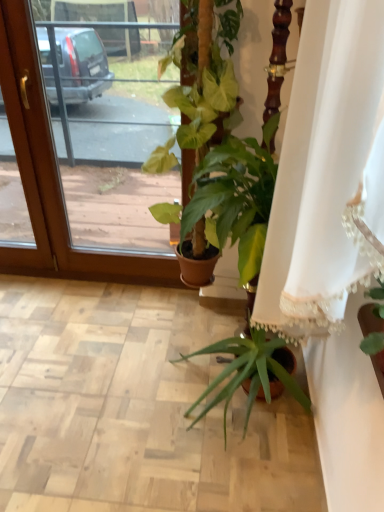
Question: From a real-world perspective, is white lace curtain at center positioned under transparent glass screen door at upper left based on gravity?

Choices:
 (A) yes
 (B) no

Answer: (B)

Question: Is the position of white lace curtain at center more distant than that of transparent glass screen door at upper left?

Choices:
 (A) no
 (B) yes

Answer: (A)

Question: Is there a large distance between white lace curtain at center and transparent glass screen door at upper left?

Choices:
 (A) no
 (B) yes

Answer: (B)

Question: Considering the relative positions of white lace curtain at center and transparent glass screen door at upper left in the image provided, is white lace curtain at center to the right of transparent glass screen door at upper left from the viewer's perspective?

Choices:
 (A) yes
 (B) no

Answer: (A)

Question: Is white lace curtain at center in front of transparent glass screen door at upper left?

Choices:
 (A) yes
 (B) no

Answer: (A)

Question: Is white lace curtain at center outside transparent glass screen door at upper left?

Choices:
 (A) yes
 (B) no

Answer: (A)

Question: From the image's perspective, is green glossy plant at center on white lace curtain at center?

Choices:
 (A) no
 (B) yes

Answer: (B)

Question: Does green glossy plant at center come behind white lace curtain at center?

Choices:
 (A) yes
 (B) no

Answer: (A)

Question: Is the surface of green glossy plant at center in direct contact with white lace curtain at center?

Choices:
 (A) yes
 (B) no

Answer: (B)

Question: Is green glossy plant at center far away from white lace curtain at center?

Choices:
 (A) yes
 (B) no

Answer: (B)

Question: Does green glossy plant at center appear on the right side of white lace curtain at center?

Choices:
 (A) yes
 (B) no

Answer: (B)

Question: Can you confirm if green glossy plant at center is shorter than white lace curtain at center?

Choices:
 (A) yes
 (B) no

Answer: (B)

Question: From a real-world perspective, is transparent glass screen door at upper left over green glossy plant at center?

Choices:
 (A) no
 (B) yes

Answer: (A)